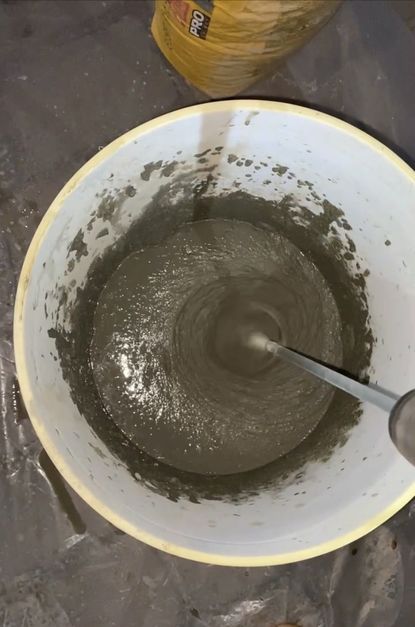
The width and height of the screenshot is (415, 627). In order to click on plastic splatter gaurd in this screenshot , I will do `click(165, 609)`.